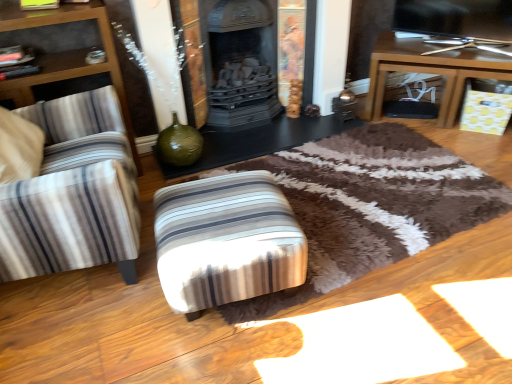
Question: Visually, is brown wooden table at right, acting as the 1th table starting from the right, positioned to the left or to the right of striped fabric ottoman at left?

Choices:
 (A) left
 (B) right

Answer: (B)

Question: Does point (452, 94) appear closer or farther from the camera than point (77, 170)?

Choices:
 (A) farther
 (B) closer

Answer: (A)

Question: Based on their relative distances, which object is farther from the black glossy table at center, which is the 2th table from right to left?

Choices:
 (A) striped fabric stool at center
 (B) brown wooden table at right, positioned as the second table in left-to-right order
 (C) striped fabric ottoman at left

Answer: (A)

Question: Based on their relative distances, which object is nearer to the striped fabric ottoman at left?

Choices:
 (A) striped fabric stool at center
 (B) brown wooden table at right, acting as the 1th table starting from the right
 (C) black glossy table at center, which ranks as the first table in left-to-right order

Answer: (A)